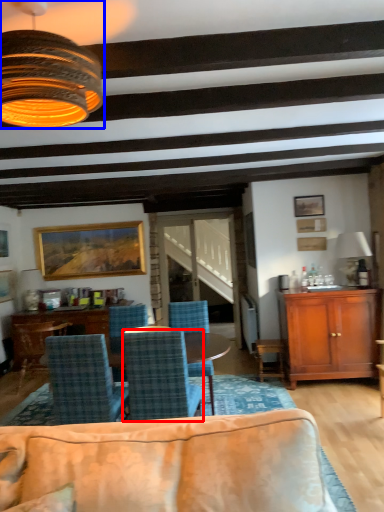
Question: Which point is further to the camera, chair (highlighted by a red box) or lamp (highlighted by a blue box)?

Choices:
 (A) chair
 (B) lamp

Answer: (A)